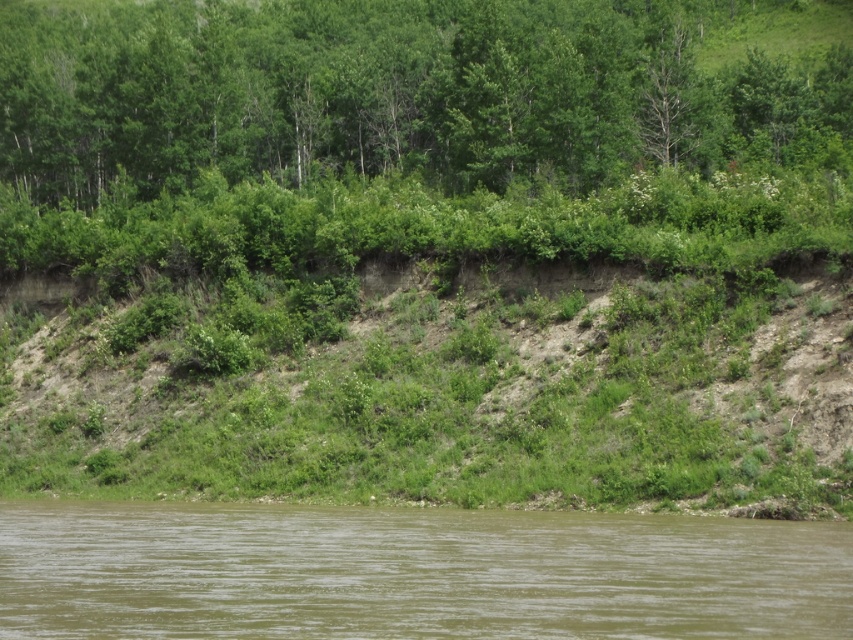
Can you confirm if green leafy trees at upper center is positioned below brown muddy water at lower center?

No, green leafy trees at upper center is not below brown muddy water at lower center.

Is green leafy trees at upper center closer to camera compared to brown muddy water at lower center?

No, green leafy trees at upper center is further to the viewer.

Based on the photo, measure the distance between green leafy trees at upper center and camera.

green leafy trees at upper center is 88.11 meters from camera.

You are a GUI agent. You are given a task and a screenshot of the screen. Output one action in this format:
    pyautogui.click(x=<x>, y=<y>)
    Task: Click on the green leafy trees at upper center
    
    Given the screenshot: What is the action you would take?
    pyautogui.click(x=412, y=90)